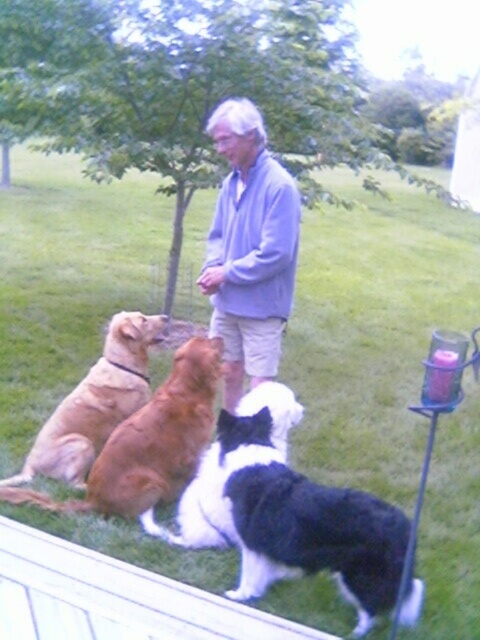
Can you confirm if black and white fur at center is taller than golden brown fur at center?

Indeed, black and white fur at center has a greater height compared to golden brown fur at center.

The image size is (480, 640). Identify the location of black and white fur at center. (287, 513).

Does black and white fur at center come behind light blue sweater at center?

No, black and white fur at center is closer to the viewer.

Does black and white fur at center have a smaller size compared to light blue sweater at center?

No.

Describe the element at coordinates (287, 513) in the screenshot. I see `black and white fur at center` at that location.

Find the location of `black and white fur at center`. black and white fur at center is located at coordinates (287, 513).

The width and height of the screenshot is (480, 640). What do you see at coordinates (250, 248) in the screenshot?
I see `light blue sweater at center` at bounding box center [250, 248].

Is light blue sweater at center positioned in front of golden brown fur at center?

Yes.

This screenshot has width=480, height=640. I want to click on light blue sweater at center, so click(250, 248).